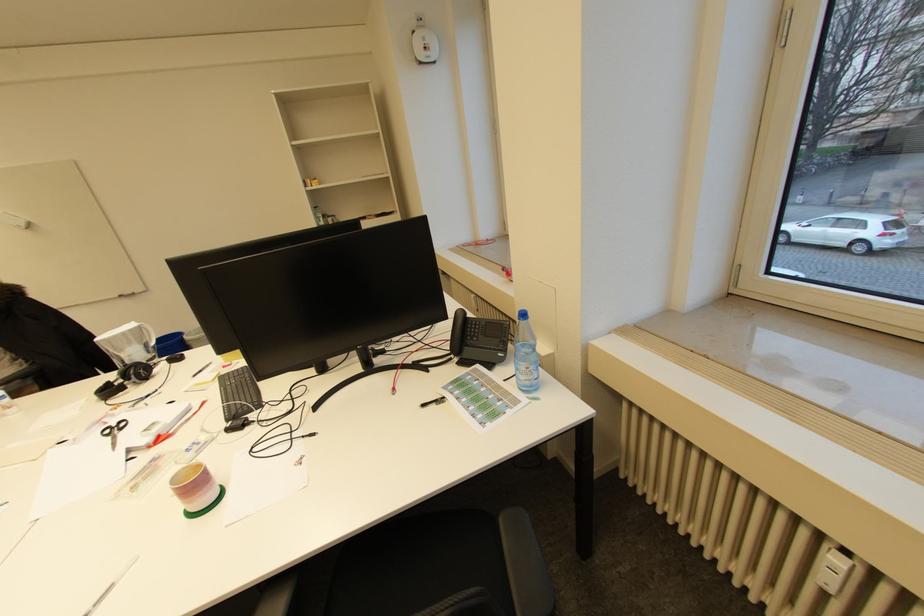
This screenshot has height=616, width=924. In order to click on black phone handset in this screenshot , I will do `click(457, 331)`.